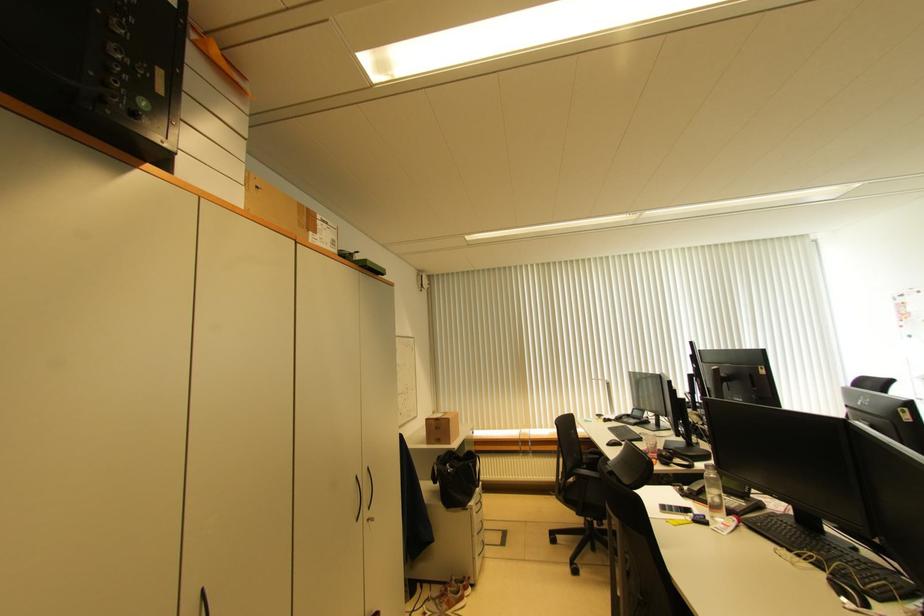
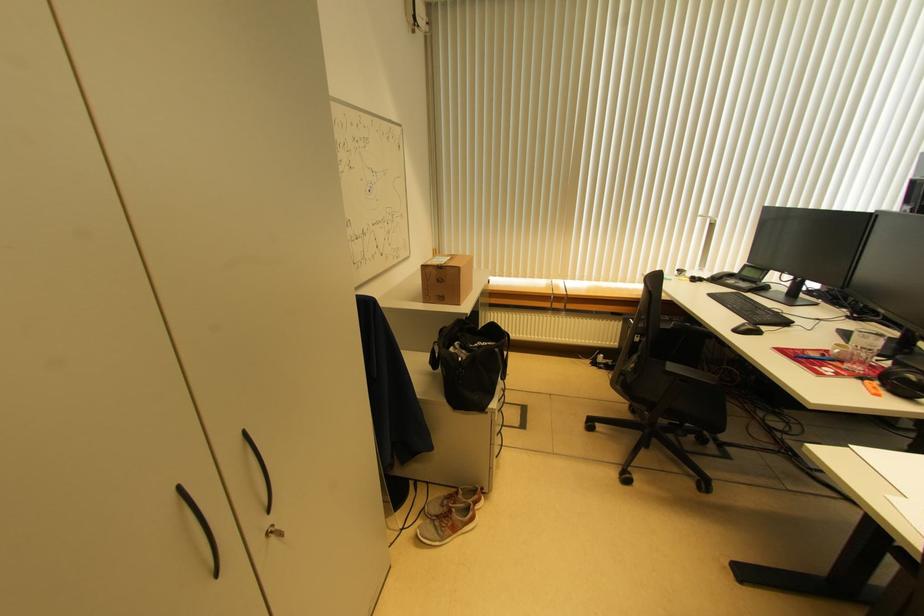
Locate, in the second image, the point that corresponds to point (636, 411) in the first image.

(748, 269)